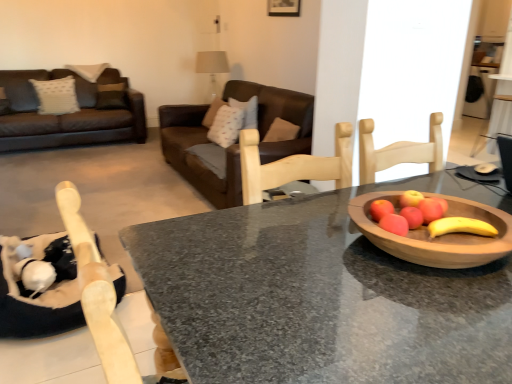
Question: Is the depth of granite table at center less than that of brown leather couch at center?

Choices:
 (A) no
 (B) yes

Answer: (B)

Question: Is granite table at center smaller than brown leather couch at center?

Choices:
 (A) yes
 (B) no

Answer: (A)

Question: Considering the relative positions of granite table at center and brown leather couch at center in the image provided, is granite table at center to the left of brown leather couch at center from the viewer's perspective?

Choices:
 (A) yes
 (B) no

Answer: (B)

Question: Is granite table at center oriented towards brown leather couch at center?

Choices:
 (A) yes
 (B) no

Answer: (B)

Question: Considering the relative sizes of granite table at center and brown leather couch at center in the image provided, is granite table at center shorter than brown leather couch at center?

Choices:
 (A) yes
 (B) no

Answer: (A)

Question: Is granite table at center next to brown leather couch at center?

Choices:
 (A) yes
 (B) no

Answer: (B)

Question: Does brown leather couch at center have a greater height compared to wooden bowl at right?

Choices:
 (A) yes
 (B) no

Answer: (A)

Question: Is brown leather couch at center positioned beyond the bounds of wooden bowl at right?

Choices:
 (A) no
 (B) yes

Answer: (B)

Question: Is brown leather couch at center shorter than wooden bowl at right?

Choices:
 (A) no
 (B) yes

Answer: (A)

Question: From a real-world perspective, is brown leather couch at center beneath wooden bowl at right?

Choices:
 (A) no
 (B) yes

Answer: (B)

Question: Does brown leather couch at center appear on the right side of wooden bowl at right?

Choices:
 (A) no
 (B) yes

Answer: (A)

Question: Does brown leather couch at center have a larger size compared to wooden bowl at right?

Choices:
 (A) yes
 (B) no

Answer: (A)

Question: Does brown leather couch at center have a greater height compared to granite table at center?

Choices:
 (A) no
 (B) yes

Answer: (B)